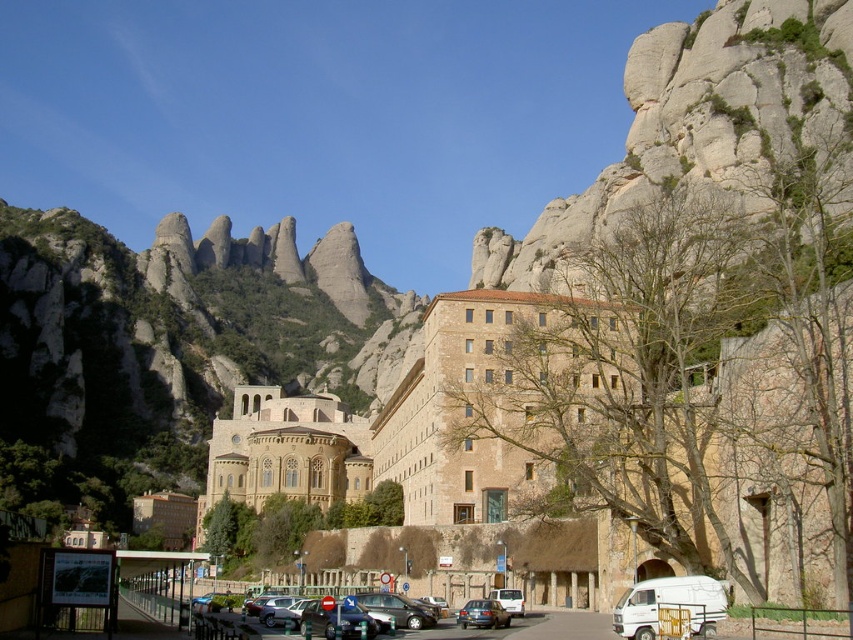
You are a visitor approaching the historic stone building and need to park your vehicle. The parking area has a white matte camper van at lower right. Is the van positioned near the entrance of the building?

The white matte camper van at lower right is located at point (669, 605), which is near the entrance of the building. Therefore, the van is positioned near the entrance.

You are a visitor approaching the brown stone building at center and the white matte camper van at lower right. Which object will you encounter first as you move towards the building?

You will encounter the white matte camper van at lower right first because it is closer to you than the brown stone building at center, which is further away.